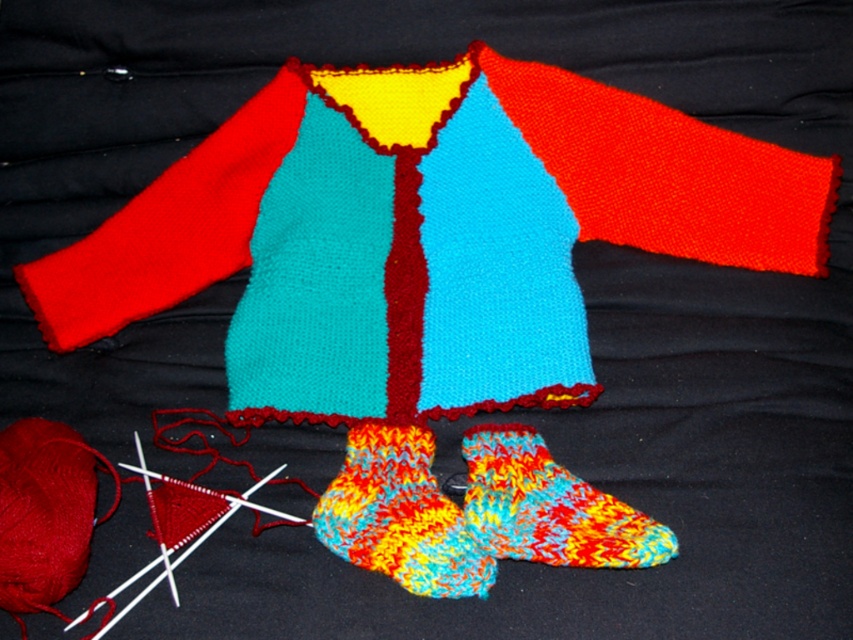
From the picture: You are organizing a childrens clothing store and need to arrange the knitted wool sweater at center and the multicolored knitted sock at center on a display shelf. According to the image, which item should be placed to the left to maintain the same spatial arrangement?

The multicolored knitted sock at center should be placed to the left since the knitted wool sweater at center is positioned on the right side of it in the image.

You are a customer at a craft store looking to buy a knitted item. You want to ensure that the sweater you choose is bigger than the socks. Based on the image provided, can you confirm if the knitted wool sweater at center is larger than the multicolored knitted sock at center?

The knitted wool sweater at center is larger in size than the multicolored knitted sock at center, so yes, the sweater is bigger than the socks.

You are a photographer setting up a shot of the multicolored knitted sock at center. The camera is positioned 1.11 meters away. If you want to capture the entire sweater behind the sock in focus, should you adjust the camera closer or farther from the sock?

The camera is already 1.11 meters away from the multicolored knitted sock at center. To ensure both the sock and the sweater behind it are in focus, you should adjust the camera farther from the sock to increase the depth of field, allowing both foreground and background elements to be sharp.